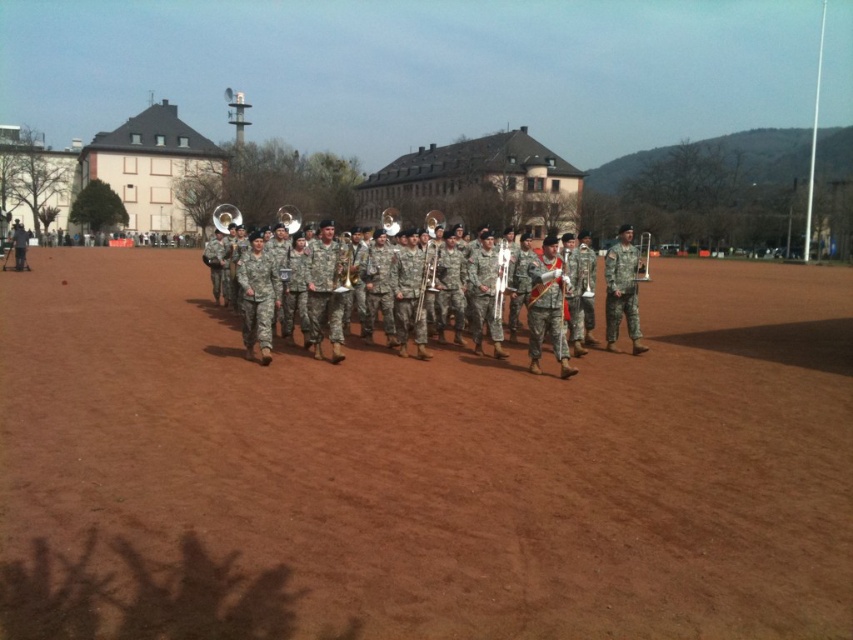
Question: Which of these objects is positioned farthest from the brown dirt field at center?

Choices:
 (A) silver metallic trombone at center
 (B) camouflage fabric band at center

Answer: (A)

Question: Which point is farther from the camera taking this photo?

Choices:
 (A) (525, 269)
 (B) (508, 262)
 (C) (4, 396)

Answer: (A)

Question: Can you confirm if camouflage fabric band at center is positioned to the right of silver metallic trombone at center?

Choices:
 (A) yes
 (B) no

Answer: (B)

Question: Can you confirm if camouflage fabric band at center is positioned below silver metallic trombone at center?

Choices:
 (A) yes
 (B) no

Answer: (B)

Question: Does camouflage fabric band at center have a greater width compared to silver metallic trombone at center?

Choices:
 (A) no
 (B) yes

Answer: (B)

Question: Which point appears closest to the camera in this image?

Choices:
 (A) (527, 300)
 (B) (583, 580)
 (C) (494, 289)

Answer: (B)